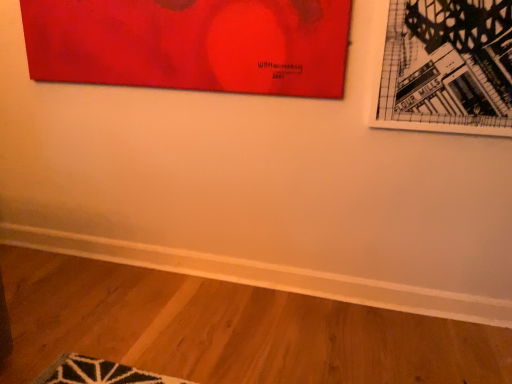
Question: Is matte red painting at upper left, the first picture frame in the left-to-right sequence, positioned with its back to black paper picture frame at upper right, the second picture frame positioned from the left?

Choices:
 (A) yes
 (B) no

Answer: (B)

Question: Could you tell me if matte red painting at upper left, the first picture frame in the left-to-right sequence, is facing black paper picture frame at upper right, the second picture frame positioned from the left?

Choices:
 (A) yes
 (B) no

Answer: (B)

Question: Can you confirm if matte red painting at upper left, the first picture frame in the left-to-right sequence, is thinner than black paper picture frame at upper right, which is the first picture frame from right to left?

Choices:
 (A) yes
 (B) no

Answer: (B)

Question: Does matte red painting at upper left, the first picture frame in the left-to-right sequence, have a greater width compared to black paper picture frame at upper right, which is the first picture frame from right to left?

Choices:
 (A) yes
 (B) no

Answer: (A)

Question: Is matte red painting at upper left, acting as the 2th picture frame starting from the right, beside black paper picture frame at upper right, the second picture frame positioned from the left?

Choices:
 (A) yes
 (B) no

Answer: (B)

Question: Does matte red painting at upper left, acting as the 2th picture frame starting from the right, appear on the right side of black paper picture frame at upper right, the second picture frame positioned from the left?

Choices:
 (A) no
 (B) yes

Answer: (A)

Question: Can you confirm if black paper picture frame at upper right, the second picture frame positioned from the left, is wider than matte red painting at upper left, the first picture frame in the left-to-right sequence?

Choices:
 (A) no
 (B) yes

Answer: (A)

Question: Is black paper picture frame at upper right, which is the first picture frame from right to left, oriented towards matte red painting at upper left, acting as the 2th picture frame starting from the right?

Choices:
 (A) no
 (B) yes

Answer: (A)

Question: Would you consider black paper picture frame at upper right, which is the first picture frame from right to left, to be distant from matte red painting at upper left, the first picture frame in the left-to-right sequence?

Choices:
 (A) no
 (B) yes

Answer: (A)

Question: Is black paper picture frame at upper right, which is the first picture frame from right to left, thinner than matte red painting at upper left, the first picture frame in the left-to-right sequence?

Choices:
 (A) no
 (B) yes

Answer: (B)

Question: From the image's perspective, is black paper picture frame at upper right, which is the first picture frame from right to left, on matte red painting at upper left, the first picture frame in the left-to-right sequence?

Choices:
 (A) yes
 (B) no

Answer: (B)

Question: Is black paper picture frame at upper right, the second picture frame positioned from the left, with matte red painting at upper left, the first picture frame in the left-to-right sequence?

Choices:
 (A) no
 (B) yes

Answer: (A)

Question: Based on their sizes in the image, would you say black paper picture frame at upper right, which is the first picture frame from right to left, is bigger or smaller than matte red painting at upper left, the first picture frame in the left-to-right sequence?

Choices:
 (A) small
 (B) big

Answer: (A)